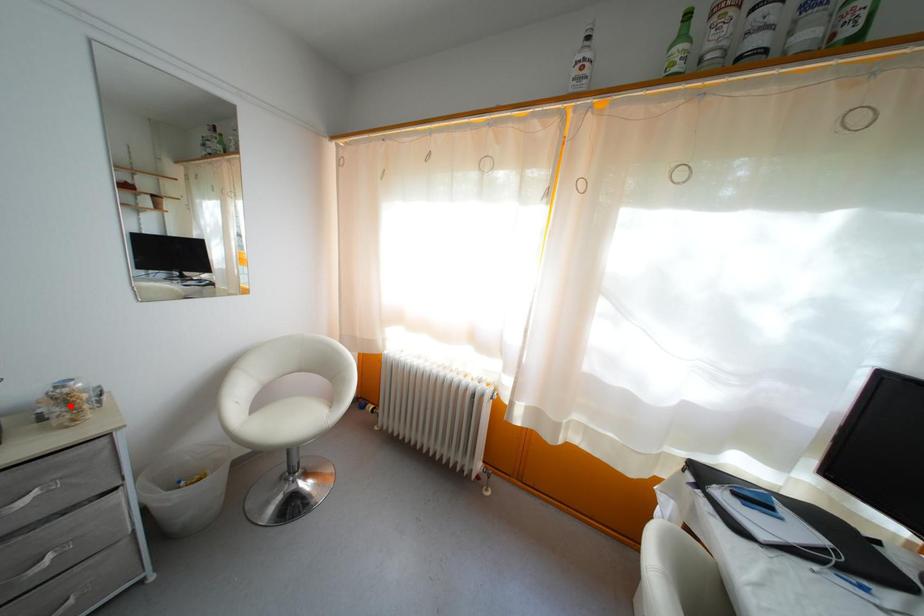
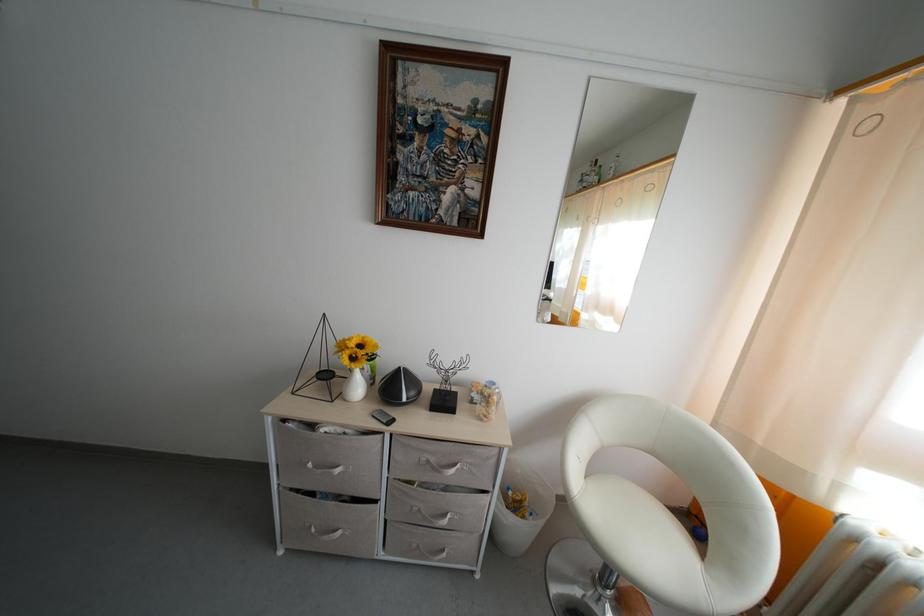
Question: I am providing you with two images of the same scene from different viewpoints. Given a red point in image1, look at the same physical point in image2. Is it:

Choices:
 (A) Closer to the viewpoint
 (B) Farther from the viewpoint

Answer: (B)